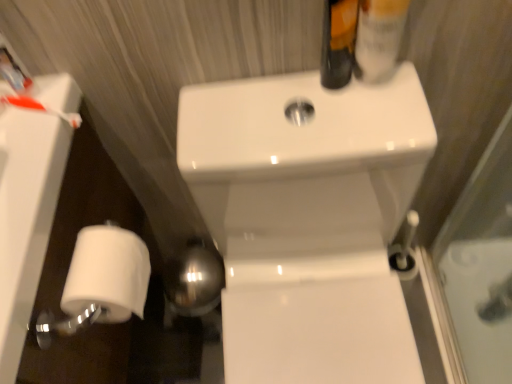
Question: From the image's perspective, would you say white matte toilet paper at lower left is shown under matte black bottle at upper right?

Choices:
 (A) no
 (B) yes

Answer: (B)

Question: Considering the relative sizes of white matte toilet paper at lower left and matte black bottle at upper right in the image provided, is white matte toilet paper at lower left wider than matte black bottle at upper right?

Choices:
 (A) yes
 (B) no

Answer: (A)

Question: Is the depth of white matte toilet paper at lower left greater than that of matte black bottle at upper right?

Choices:
 (A) no
 (B) yes

Answer: (B)

Question: Can you see white matte toilet paper at lower left touching matte black bottle at upper right?

Choices:
 (A) yes
 (B) no

Answer: (B)

Question: Is the depth of white matte toilet paper at lower left less than that of matte black bottle at upper right?

Choices:
 (A) yes
 (B) no

Answer: (B)

Question: Can you confirm if white matte toilet paper at lower left is bigger than matte black bottle at upper right?

Choices:
 (A) no
 (B) yes

Answer: (B)

Question: From a real-world perspective, is matte black bottle at upper right physically above white glossy sink at center?

Choices:
 (A) yes
 (B) no

Answer: (A)

Question: Would you consider matte black bottle at upper right to be distant from white glossy sink at center?

Choices:
 (A) no
 (B) yes

Answer: (A)

Question: Could you tell me if matte black bottle at upper right is facing white glossy sink at center?

Choices:
 (A) yes
 (B) no

Answer: (B)

Question: Is matte black bottle at upper right smaller than white glossy sink at center?

Choices:
 (A) yes
 (B) no

Answer: (A)

Question: From a real-world perspective, is matte black bottle at upper right located beneath white glossy sink at center?

Choices:
 (A) yes
 (B) no

Answer: (B)

Question: Is matte black bottle at upper right surrounding white glossy sink at center?

Choices:
 (A) yes
 (B) no

Answer: (B)

Question: Is translucent plastic mouthwash at upper right looking in the opposite direction of matte black bottle at upper right?

Choices:
 (A) no
 (B) yes

Answer: (A)